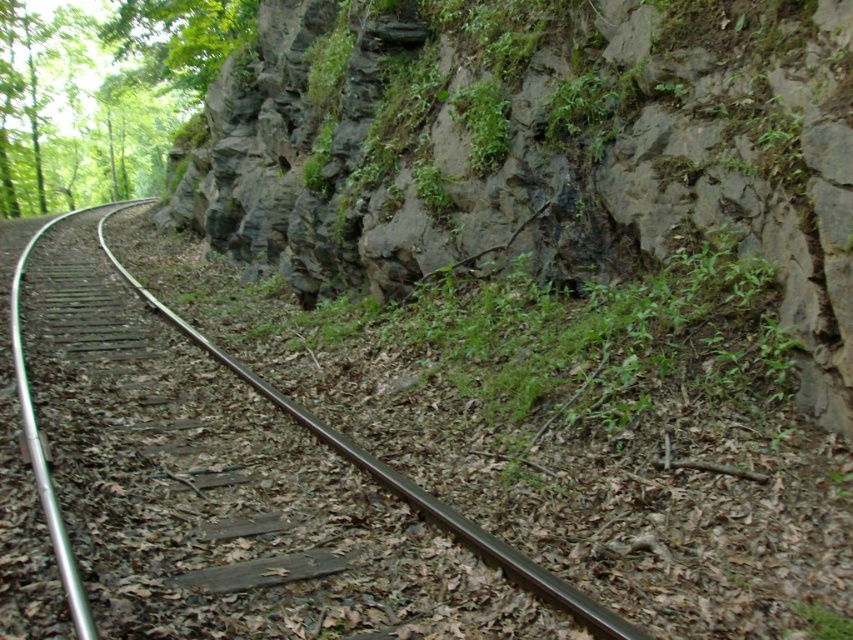
Between rocky cliff at center and black metal track at left, which one has more height?

Standing taller between the two is black metal track at left.

Who is positioned more to the right, rocky cliff at center or black metal track at left?

From the viewer's perspective, rocky cliff at center appears more on the right side.

The height and width of the screenshot is (640, 853). I want to click on rocky cliff at center, so click(543, 154).

Does green leafy tree at upper left have a lesser height compared to black metal track at left?

No, green leafy tree at upper left is not shorter than black metal track at left.

Does green leafy tree at upper left appear on the right side of black metal track at left?

No, green leafy tree at upper left is not to the right of black metal track at left.

What are the coordinates of `green leafy tree at upper left` in the screenshot? It's located at (102, 93).

Is rocky cliff at center bigger than green leafy tree at upper left?

Actually, rocky cliff at center might be smaller than green leafy tree at upper left.

Which is behind, point (489, 225) or point (228, 42)?

Point (228, 42)

Who is more forward, [784,236] or [13,168]?

Point [784,236]

Find the location of a particular element. The height and width of the screenshot is (640, 853). rocky cliff at center is located at coordinates (543, 154).